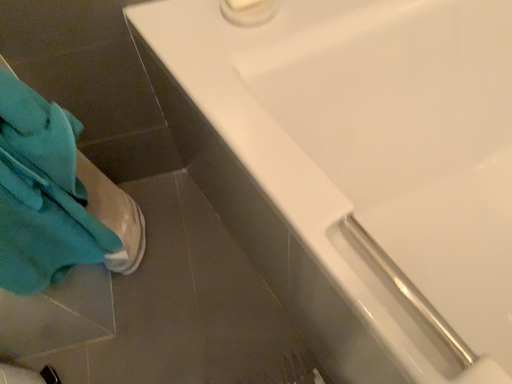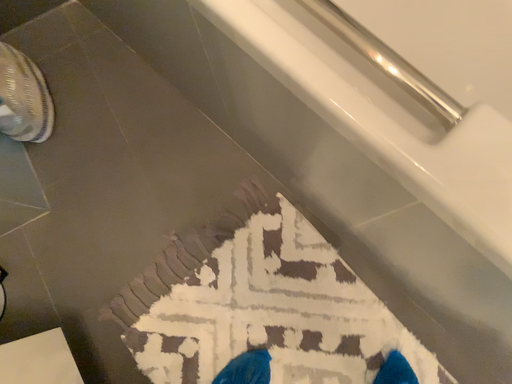
Question: How did the camera likely rotate when shooting the video?

Choices:
 (A) rotated downward
 (B) rotated upward

Answer: (A)